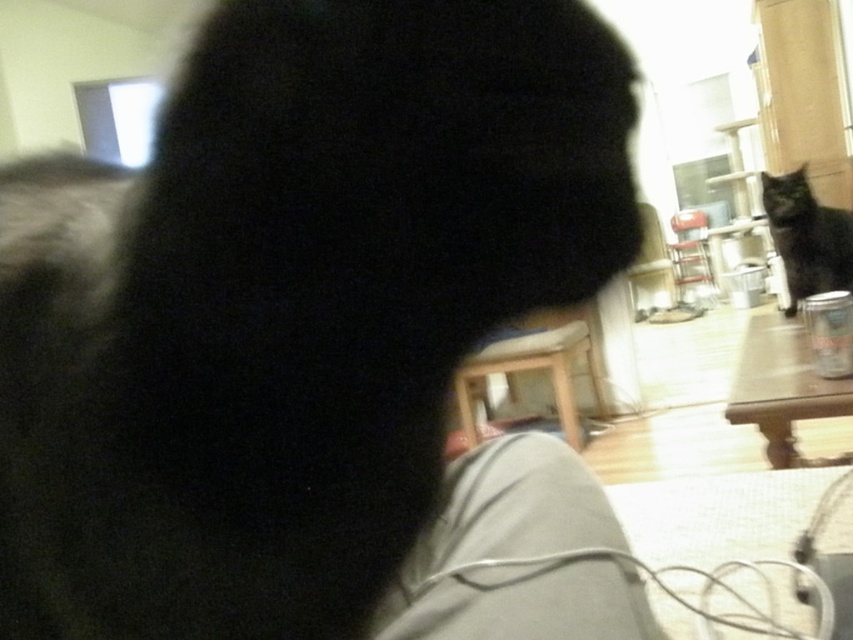
You are trying to decide whether to place a small decorative item on the gray fabric at lower center or the black fuzzy cat at upper right. Based on their sizes, which surface can accommodate the item more comfortably?

The black fuzzy cat at upper right has a larger size compared to the gray fabric at lower center, so placing the item on the black fuzzy cat at upper right would provide more comfortable accommodation.

You are trying to decide whether to place a small potted plant on the gray fabric at lower center. Considering the height of the black fuzzy cat at upper right, will the plant be visible to the cat when placed there?

The gray fabric at lower center is not as tall as the black fuzzy cat at upper right, so the plant placed on the gray fabric at lower center will be visible to the cat since the cat is taller.

You are a delivery person entering the room and need to place a small package on the gray fabric at lower center. Considering the space available, will the package fit if it is the same size as the black fuzzy cat at upper right?

The gray fabric at lower center has a width less than the black fuzzy cat at upper right. Since the package is the same size as the black fuzzy cat at upper right, it may not fit on the gray fabric at lower center due to its smaller width.